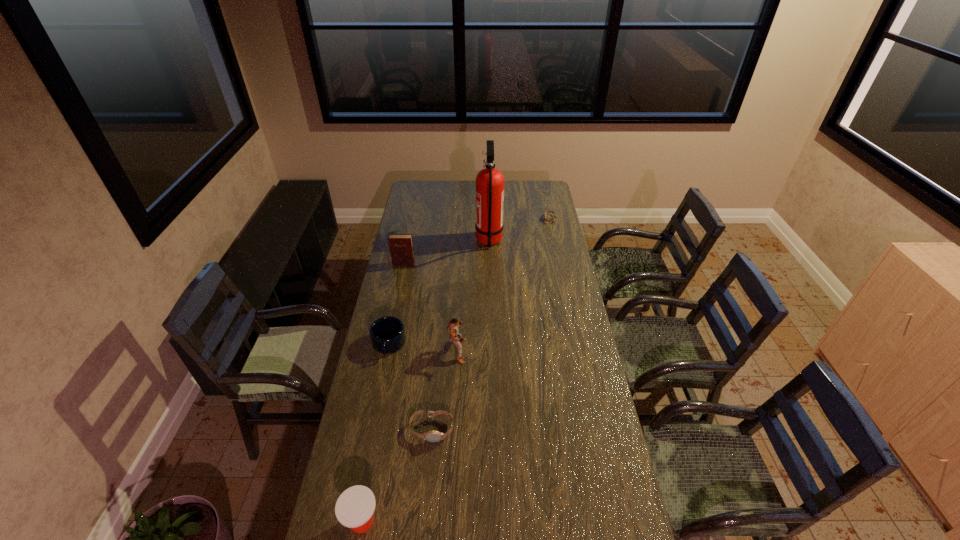
Please mark a free spot for a new watch to balance the arrangement. Please provide its 2D coordinates. Your answer should be formatted as a tuple, i.e. [(x, y)], where the tuple contains the x and y coordinates of a point satisfying the conditions above.

[(505, 299)]